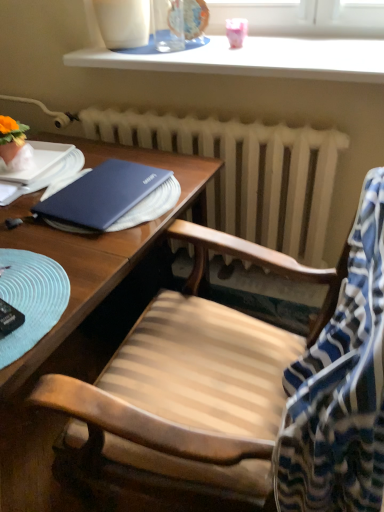
Question: Is white glossy window sill at upper center oriented towards white matte radiator at center?

Choices:
 (A) no
 (B) yes

Answer: (A)

Question: From the image's perspective, is white glossy window sill at upper center on white matte radiator at center?

Choices:
 (A) yes
 (B) no

Answer: (A)

Question: From the image's perspective, would you say white glossy window sill at upper center is shown under white matte radiator at center?

Choices:
 (A) no
 (B) yes

Answer: (A)

Question: Can you confirm if white glossy window sill at upper center is smaller than white matte radiator at center?

Choices:
 (A) no
 (B) yes

Answer: (B)

Question: Can we say white glossy window sill at upper center lies outside white matte radiator at center?

Choices:
 (A) yes
 (B) no

Answer: (A)

Question: Is there a large distance between white glossy window sill at upper center and white matte radiator at center?

Choices:
 (A) yes
 (B) no

Answer: (B)

Question: Does white matte radiator at center have a greater width compared to white glossy window sill at upper center?

Choices:
 (A) yes
 (B) no

Answer: (B)

Question: Is white glossy window sill at upper center completely or partially inside white matte radiator at center?

Choices:
 (A) yes
 (B) no

Answer: (B)

Question: Considering the relative sizes of white matte radiator at center and white glossy window sill at upper center in the image provided, is white matte radiator at center shorter than white glossy window sill at upper center?

Choices:
 (A) no
 (B) yes

Answer: (A)

Question: Considering the relative sizes of white matte radiator at center and white glossy window sill at upper center in the image provided, is white matte radiator at center thinner than white glossy window sill at upper center?

Choices:
 (A) no
 (B) yes

Answer: (B)

Question: Does white matte radiator at center have a larger size compared to white glossy window sill at upper center?

Choices:
 (A) yes
 (B) no

Answer: (A)

Question: Considering the relative positions of white matte radiator at center and white glossy window sill at upper center in the image provided, is white matte radiator at center behind white glossy window sill at upper center?

Choices:
 (A) yes
 (B) no

Answer: (A)

Question: Is the depth of blue striped fabric at right greater than that of white glossy window sill at upper center?

Choices:
 (A) no
 (B) yes

Answer: (A)